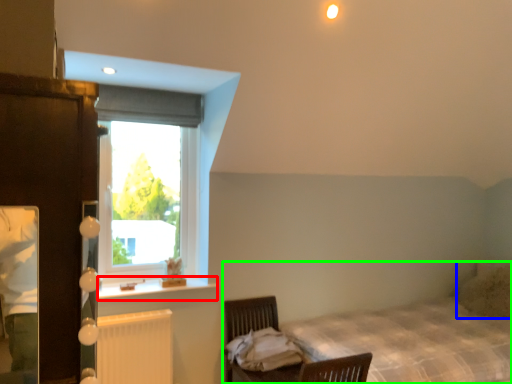
Question: Considering the real-world distances, which object is closest to window sill (highlighted by a red box)? pillow (highlighted by a blue box) or bed (highlighted by a green box).

Choices:
 (A) pillow
 (B) bed

Answer: (B)